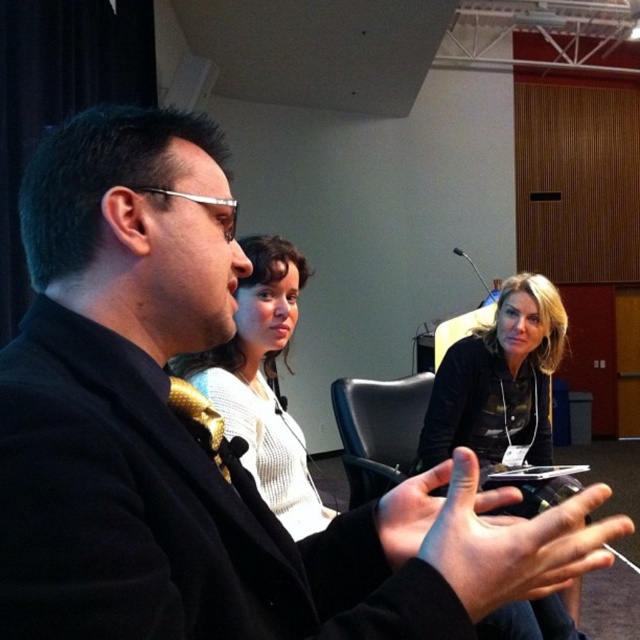
Consider the image. Does black fabric shirt at center appear on the right side of white knit sweater at center?

Indeed, black fabric shirt at center is positioned on the right side of white knit sweater at center.

Which is behind, point (547, 362) or point (310, 500)?

The point (547, 362) is more distant.

Image resolution: width=640 pixels, height=640 pixels. What are the coordinates of `black fabric shirt at center` in the screenshot? It's located at (499, 381).

Locate an element on the screen. The image size is (640, 640). black fabric shirt at center is located at coordinates (499, 381).

Can you confirm if black fabric shirt at center is positioned to the left of black leather chair at center?

In fact, black fabric shirt at center is to the right of black leather chair at center.

Who is taller, black fabric shirt at center or black leather chair at center?

black fabric shirt at center

Which is behind, point (474, 390) or point (385, 454)?

Positioned behind is point (385, 454).

You are a GUI agent. You are given a task and a screenshot of the screen. Output one action in this format:
    pyautogui.click(x=<x>, y=<y>)
    Task: Click on the black fabric shirt at center
    The width and height of the screenshot is (640, 640).
    Given the screenshot: What is the action you would take?
    pyautogui.click(x=499, y=381)

Where is `white knit sweater at center`? The image size is (640, 640). white knit sweater at center is located at coordinates (262, 384).

Is point (298, 461) behind point (403, 417)?

No, (298, 461) is closer to viewer.

Describe the element at coordinates (262, 384) in the screenshot. I see `white knit sweater at center` at that location.

Identify the location of white knit sweater at center. (262, 384).